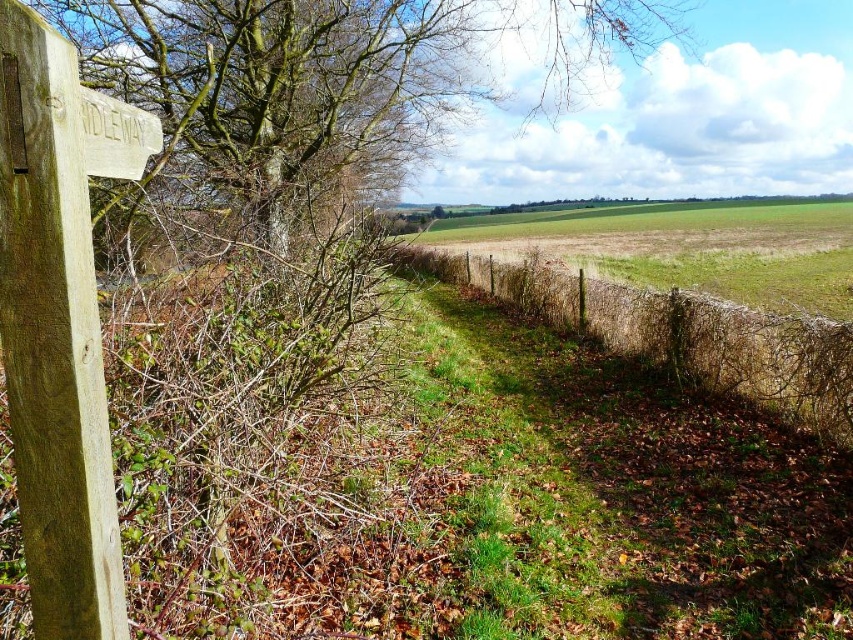
You are a hiker trying to navigate through the rural area shown in the image. You see the brown bark tree at upper left and the wooden signpost at left. Which object would block your view more if you were standing directly in front of them?

The brown bark tree at upper left has a larger size compared to the wooden signpost at left, so it would block your view more than the wooden signpost at left.

You are standing at the base of the brown bark tree at upper left in the rural scene. You want to walk straight ahead to a point 20 feet away. Will you reach the wooden post with the sign before or after walking 20 feet?

The brown bark tree at upper left and viewer are 17.53 feet apart from each other. Since you are starting at the base of the tree and walking straight ahead, you will reach the wooden post with the sign after 17.53 feet, which is before the 20 feet mark. Therefore, you will reach the wooden post with the sign before walking 20 feet.

You are a hiker trying to locate the brown bark tree at upper left in the image. What are the coordinates where you should look?

The brown bark tree at upper left is located at coordinates point (x=334, y=77).